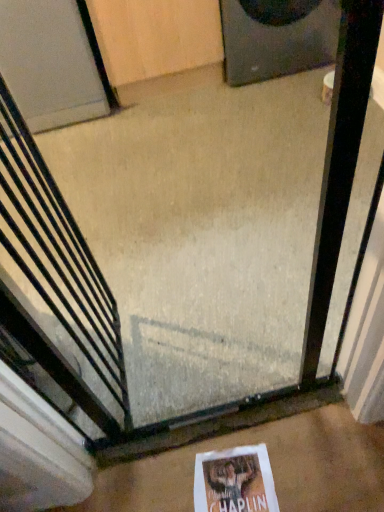
Question: Is white matte door at upper left positioned behind white concrete at center?

Choices:
 (A) yes
 (B) no

Answer: (A)

Question: From the image's perspective, would you say white matte door at upper left is positioned over white concrete at center?

Choices:
 (A) yes
 (B) no

Answer: (A)

Question: Is white matte door at upper left turned away from white concrete at center?

Choices:
 (A) no
 (B) yes

Answer: (A)

Question: Is white matte door at upper left aimed at white concrete at center?

Choices:
 (A) no
 (B) yes

Answer: (B)

Question: From the image's perspective, is white matte door at upper left located beneath white concrete at center?

Choices:
 (A) no
 (B) yes

Answer: (A)

Question: Does white matte door at upper left have a lesser width compared to white concrete at center?

Choices:
 (A) no
 (B) yes

Answer: (A)

Question: Is white paper at lower center positioned before black metal escalator at center?

Choices:
 (A) no
 (B) yes

Answer: (A)

Question: Is white paper at lower center thinner than black metal escalator at center?

Choices:
 (A) no
 (B) yes

Answer: (A)

Question: Considering the relative sizes of white paper at lower center and black metal escalator at center in the image provided, is white paper at lower center bigger than black metal escalator at center?

Choices:
 (A) yes
 (B) no

Answer: (B)

Question: From a real-world perspective, is white paper at lower center physically below black metal escalator at center?

Choices:
 (A) yes
 (B) no

Answer: (A)

Question: From a real-world perspective, does white paper at lower center stand above black metal escalator at center?

Choices:
 (A) yes
 (B) no

Answer: (B)

Question: Is white paper at lower center shorter than black metal escalator at center?

Choices:
 (A) yes
 (B) no

Answer: (A)

Question: Is white matte door at upper left thinner than black matte speaker at upper right?

Choices:
 (A) yes
 (B) no

Answer: (A)